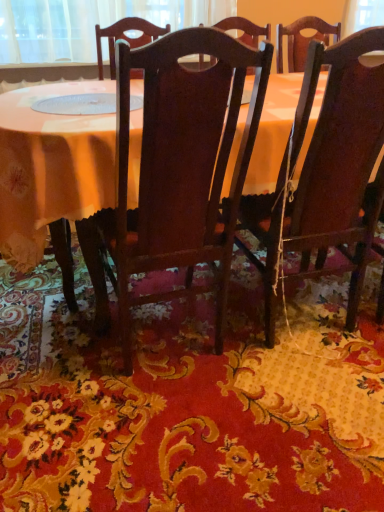
Question: Can you confirm if wooden table at center is bigger than dark wood chair at right, placed as the first chair when sorted from right to left?

Choices:
 (A) yes
 (B) no

Answer: (A)

Question: Could you tell me if wooden table at center is turned towards dark wood chair at right, placed as the first chair when sorted from right to left?

Choices:
 (A) no
 (B) yes

Answer: (B)

Question: Is wooden table at center next to dark wood chair at right, placed as the 2th chair when sorted from left to right?

Choices:
 (A) no
 (B) yes

Answer: (A)

Question: Can dark wood chair at right, placed as the 2th chair when sorted from left to right, be found inside wooden table at center?

Choices:
 (A) yes
 (B) no

Answer: (A)

Question: Does wooden table at center have a smaller size compared to dark wood chair at right, placed as the first chair when sorted from right to left?

Choices:
 (A) no
 (B) yes

Answer: (A)

Question: From the image's perspective, is wooden table at center on dark wood chair at right, placed as the 2th chair when sorted from left to right?

Choices:
 (A) yes
 (B) no

Answer: (A)

Question: Is dark wood chair at center, the 2th chair from the right, next to wooden table at center and touching it?

Choices:
 (A) no
 (B) yes

Answer: (A)

Question: Is dark wood chair at center, the 2th chair from the right, looking in the opposite direction of wooden table at center?

Choices:
 (A) yes
 (B) no

Answer: (A)

Question: Is dark wood chair at center, the 2th chair from the right, far away from wooden table at center?

Choices:
 (A) no
 (B) yes

Answer: (A)

Question: Is dark wood chair at center, the 2th chair from the right, further to the viewer compared to wooden table at center?

Choices:
 (A) yes
 (B) no

Answer: (B)

Question: Can you confirm if dark wood chair at center, the 2th chair from the right, is wider than wooden table at center?

Choices:
 (A) yes
 (B) no

Answer: (B)

Question: Does dark wood chair at center, the first chair positioned from the left, have a lesser width compared to wooden table at center?

Choices:
 (A) yes
 (B) no

Answer: (A)

Question: Is wooden table at center wider than dark wood chair at center, the first chair positioned from the left?

Choices:
 (A) no
 (B) yes

Answer: (B)